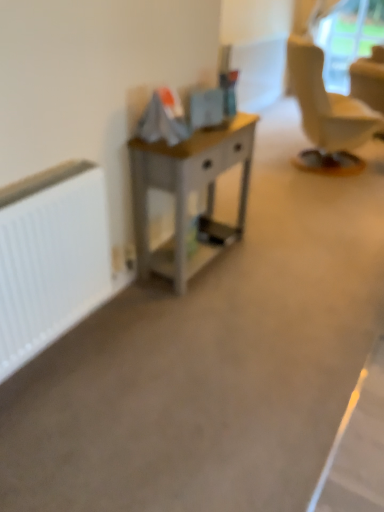
You are a GUI agent. You are given a task and a screenshot of the screen. Output one action in this format:
    pyautogui.click(x=<x>, y=<y>)
    Task: Click on the free space above white matte radiator at left (from a real-world perspective)
    Image resolution: width=384 pixels, height=512 pixels.
    Given the screenshot: What is the action you would take?
    pyautogui.click(x=38, y=181)